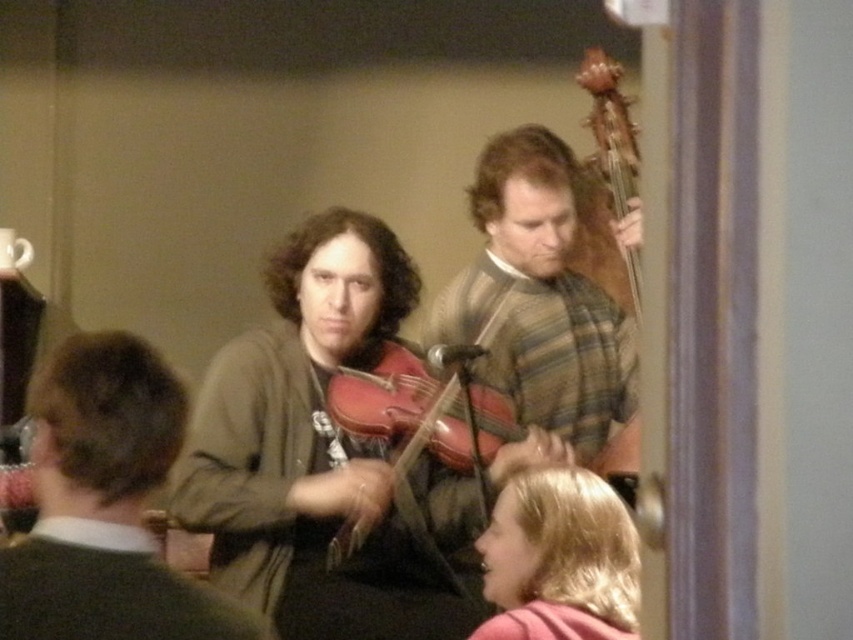
Does point (113, 435) lie in front of point (408, 451)?

Yes, it is.

Is matte brown violin at center taller than matte wood violin at center?

Incorrect, matte brown violin at center's height is not larger of matte wood violin at center's.

This screenshot has height=640, width=853. What do you see at coordinates (106, 506) in the screenshot?
I see `matte brown violin at center` at bounding box center [106, 506].

The width and height of the screenshot is (853, 640). In order to click on matte brown violin at center in this screenshot , I will do `click(106, 506)`.

Does matte brown violin at center have a lesser width compared to striped wool sweater at center?

Correct, matte brown violin at center's width is less than striped wool sweater at center's.

Between matte brown violin at center and striped wool sweater at center, which one appears on the left side from the viewer's perspective?

matte brown violin at center is more to the left.

Which is in front, point (236, 621) or point (479, 284)?

Positioned in front is point (236, 621).

Where is `matte brown violin at center`? matte brown violin at center is located at coordinates (106, 506).

Can you confirm if striped wool sweater at center is wider than matte wood violin at center?

Correct, the width of striped wool sweater at center exceeds that of matte wood violin at center.

Is point (448, 284) positioned before point (460, 456)?

No.

Describe the element at coordinates (538, 298) in the screenshot. This screenshot has width=853, height=640. I see `striped wool sweater at center` at that location.

I want to click on striped wool sweater at center, so click(x=538, y=298).